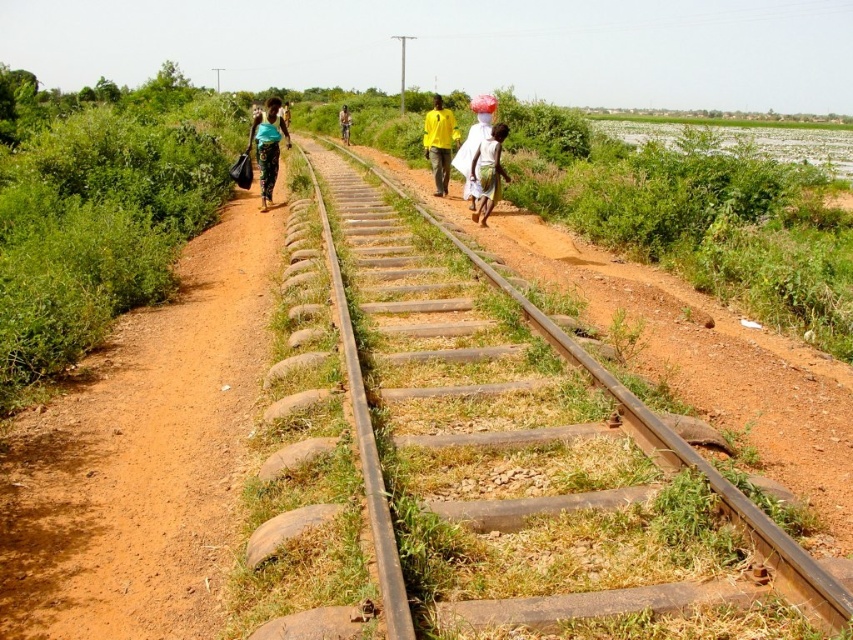
Is point (260, 182) closer to viewer compared to point (479, 186)?

No, it is not.

Is matte green shirt at center below white cotton cloth at center?

Actually, matte green shirt at center is above white cotton cloth at center.

Locate an element on the screen. matte green shirt at center is located at coordinates (267, 145).

Who is positioned more to the left, brown dirt path at center or white cloth at center?

Positioned to the left is brown dirt path at center.

Is brown dirt path at center behind white cloth at center?

No, it is in front of white cloth at center.

Between point (112, 493) and point (457, 157), which one is positioned behind?

The point (457, 157) is more distant.

Find the location of `brown dirt path at center`. brown dirt path at center is located at coordinates (143, 456).

Which of these two, smooth metal track at center or yellow matte shirt at center, stands shorter?

smooth metal track at center is shorter.

Who is higher up, smooth metal track at center or yellow matte shirt at center?

Positioned higher is yellow matte shirt at center.

Is point (477, 525) closer to camera compared to point (451, 115)?

Yes.

The width and height of the screenshot is (853, 640). I want to click on smooth metal track at center, so click(x=659, y=435).